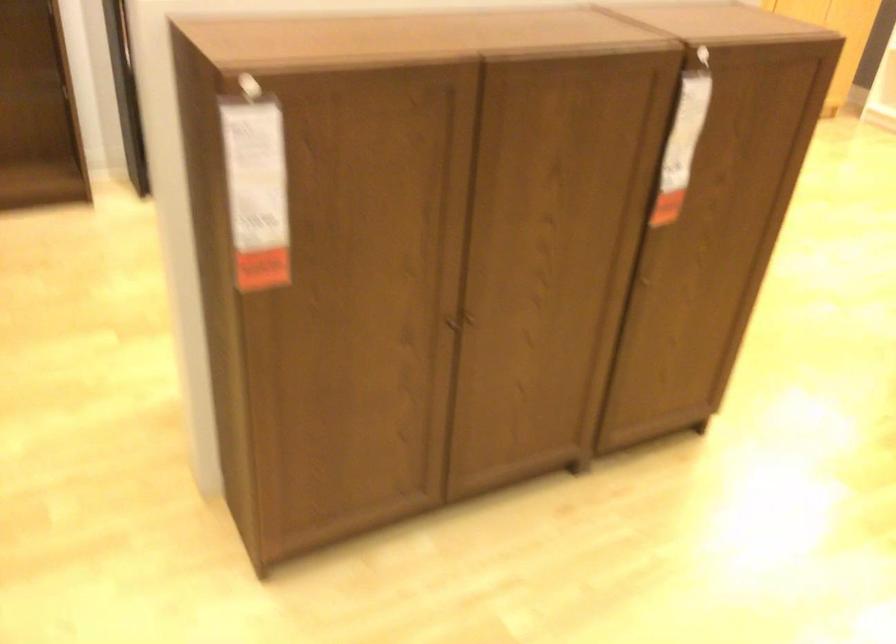
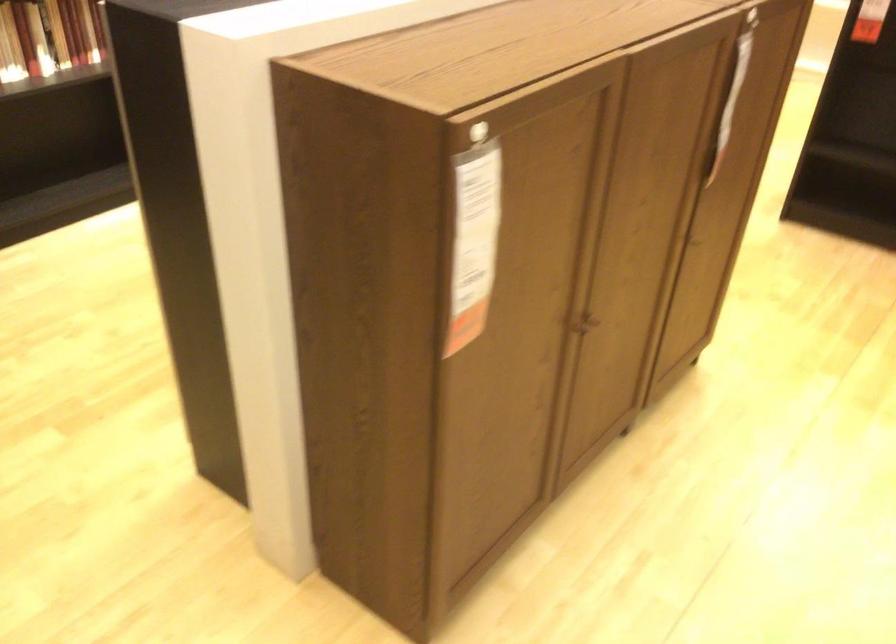
Based on the photo, in a continuous first-person perspective shot, in which direction is the camera moving?

The cameraman moved toward left, forward.